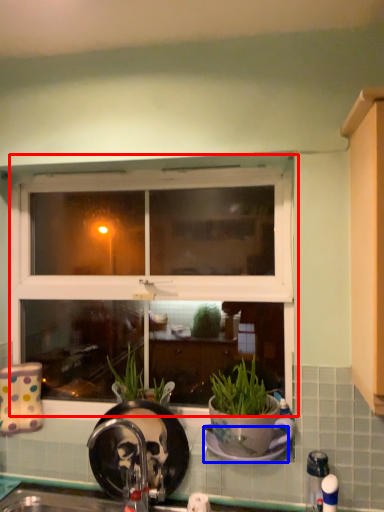
Question: Which point is closer to the camera, window (highlighted by a red box) or plate (highlighted by a blue box)?

Choices:
 (A) window
 (B) plate

Answer: (B)